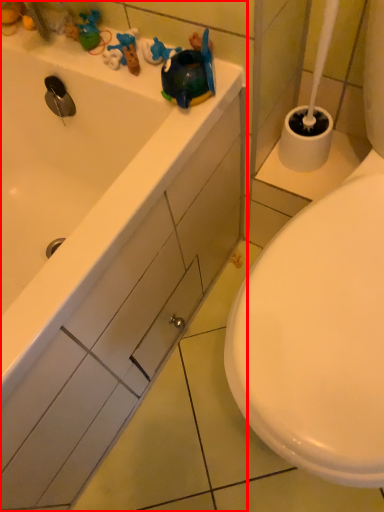
Question: From the image's perspective, what is the correct spatial positioning of bathtub (annotated by the red box) in reference to drawer?

Choices:
 (A) below
 (B) above

Answer: (B)